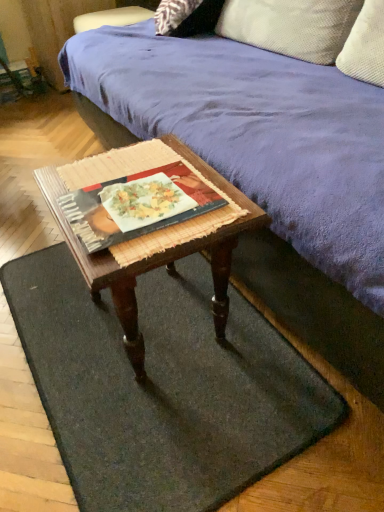
Locate an element on the screen. free point below green felt doormat at lower center (from a real-world perspective) is located at coordinates (156, 411).